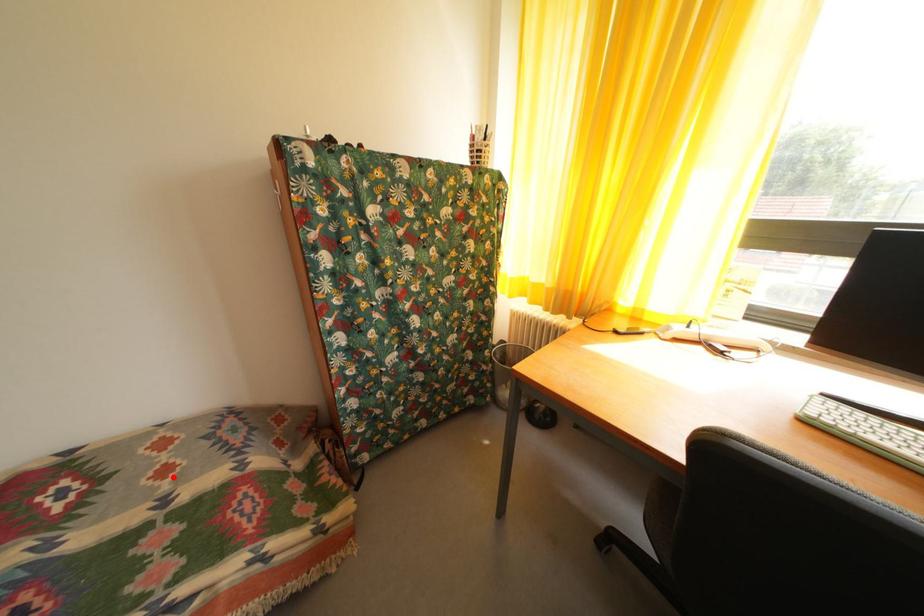
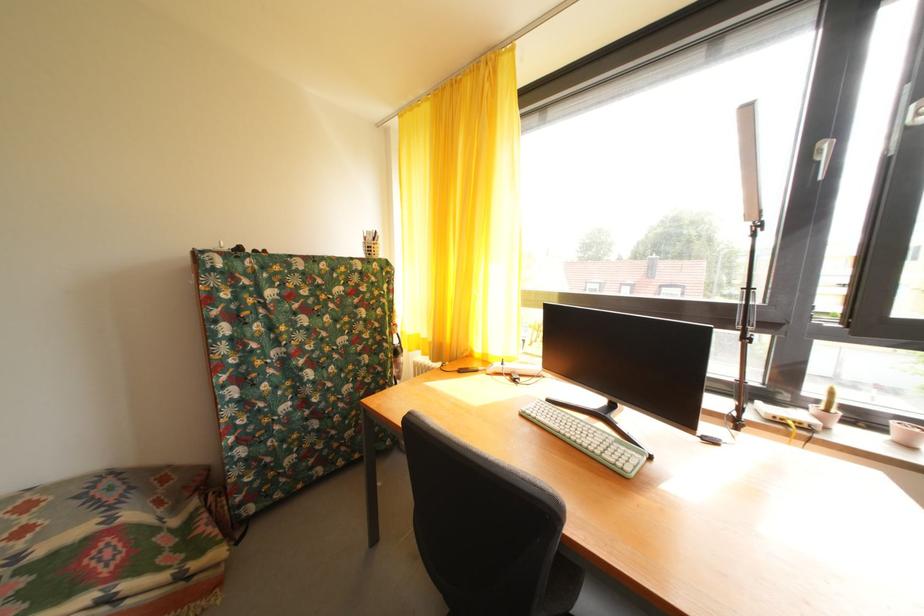
In the second image, find the point that corresponds to the highlighted location in the first image.

(31, 538)